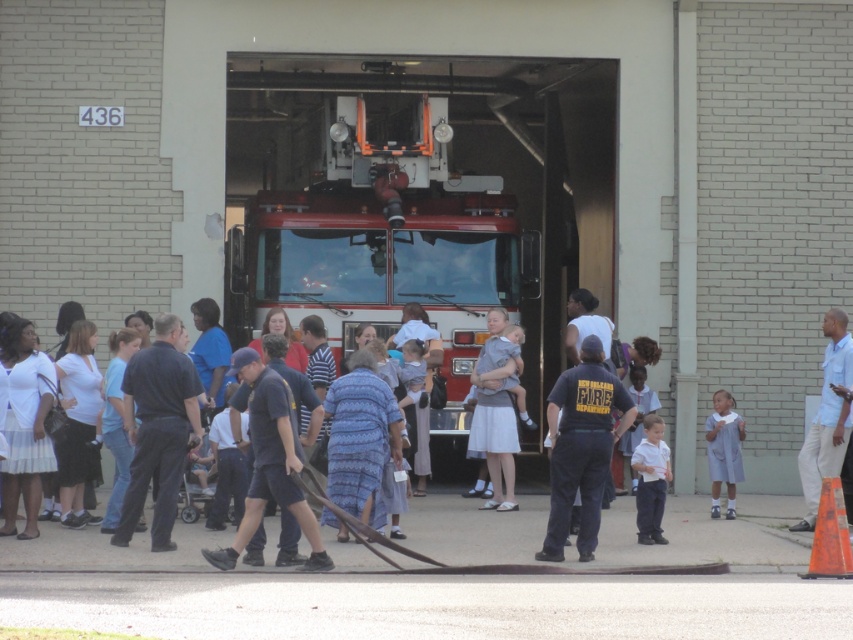
You are a photographer at the fire station event and need to arrange two people wearing the light blue shirt at center and the white matte shirt at center for a photo. Which person should stand in the back to ensure both are fully visible?

The light blue shirt at center is taller than the white matte shirt at center, so the person wearing the light blue shirt at center should stand in the back to ensure both are fully visible.

You are a photographer trying to capture a clear photo of the light blue shirt at center and the white matte shirt at center. Which shirt is covering part of the other one?

The light blue shirt at center is positioned over the white matte shirt at center, so it is covering part of it.